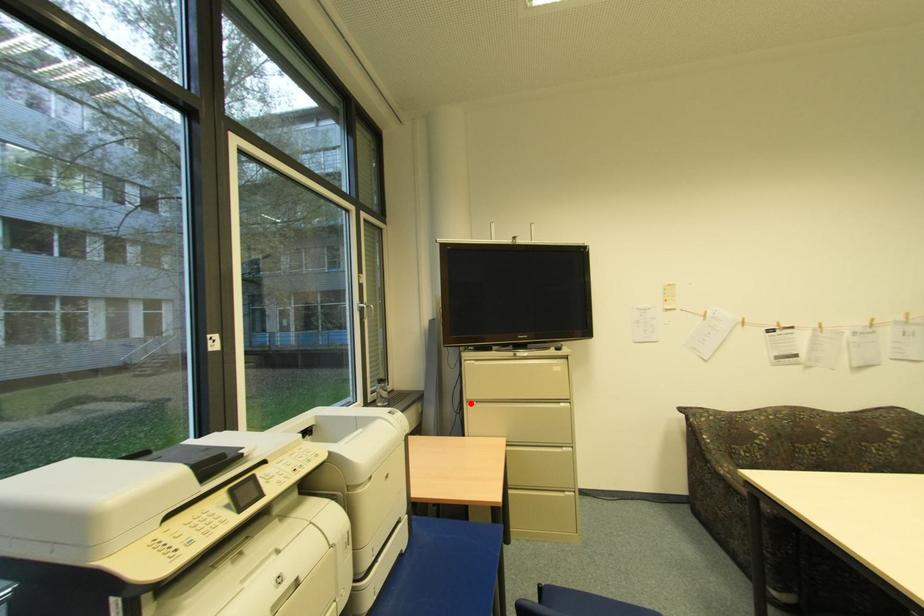
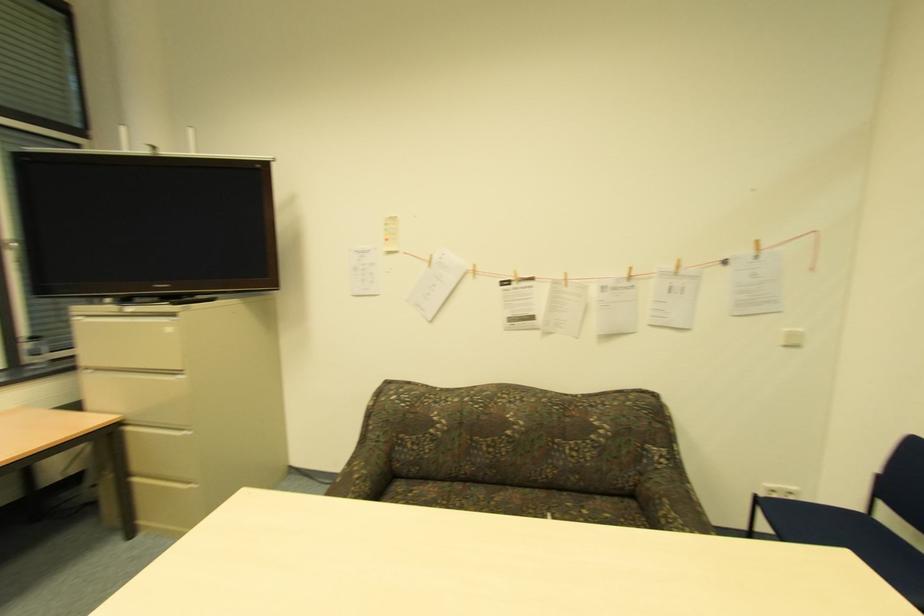
Locate, in the second image, the point that corresponds to the highlighted location in the first image.

(91, 370)